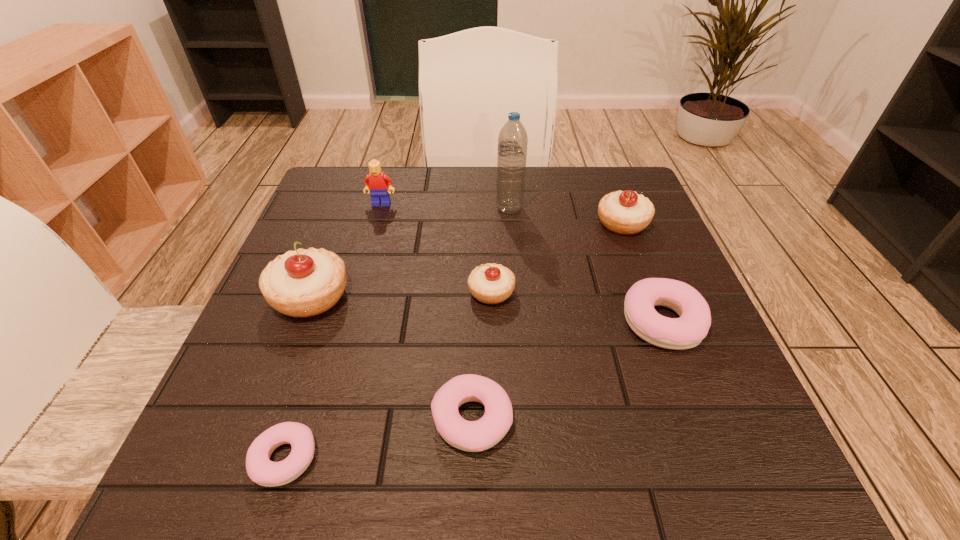
Locate an element on the screen. The image size is (960, 540). blue water bottle is located at coordinates (512, 142).

Locate an element on the screen. water bottle is located at coordinates (512, 142).

At what (x,y) coordinates should I click in order to perform the action: click on Lego. Please return your answer as a coordinate pair (x, y). The height and width of the screenshot is (540, 960). Looking at the image, I should click on (376, 182).

Locate an element on the screen. The height and width of the screenshot is (540, 960). the biggest beige pastry is located at coordinates (302, 283).

You are a GUI agent. You are given a task and a screenshot of the screen. Output one action in this format:
    pyautogui.click(x=<x>, y=<y>)
    Task: Click on the tallest pastry
    
    Given the screenshot: What is the action you would take?
    pyautogui.click(x=302, y=283)

Where is `the farthest pastry`? The image size is (960, 540). the farthest pastry is located at coordinates (624, 212).

This screenshot has height=540, width=960. I want to click on the second tallest pastry, so click(624, 212).

Identify the location of the third tallest pastry. The image size is (960, 540). pos(491,283).

At what (x,y) coordinates should I click in order to perform the action: click on the fourth shortest object. Please return your answer as a coordinate pair (x, y). Looking at the image, I should click on (491, 283).

Identify the location of the rightmost pink pastry. The width and height of the screenshot is (960, 540). (688, 331).